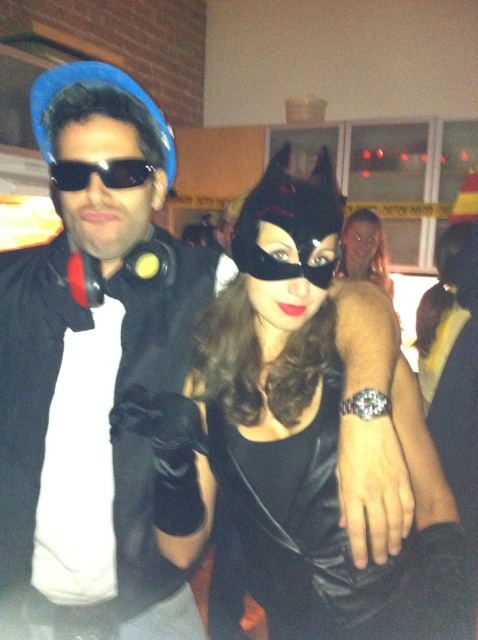
Is black leather mask at center thinner than black matte sunglasses at center?

No, black leather mask at center is not thinner than black matte sunglasses at center.

Who is lower down, black leather mask at center or black matte sunglasses at center?

black leather mask at center is lower down.

The width and height of the screenshot is (478, 640). Describe the element at coordinates (294, 442) in the screenshot. I see `black leather mask at center` at that location.

Image resolution: width=478 pixels, height=640 pixels. What are the coordinates of `black leather mask at center` in the screenshot? It's located at (294, 442).

Is point (312, 310) less distant than point (365, 209)?

Yes.

Does black leather mask at center have a lesser width compared to matte black mask at center?

No, black leather mask at center is not thinner than matte black mask at center.

You are a GUI agent. You are given a task and a screenshot of the screen. Output one action in this format:
    pyautogui.click(x=<x>, y=<y>)
    Task: Click on the black leather mask at center
    
    Given the screenshot: What is the action you would take?
    pyautogui.click(x=294, y=442)

Does matte black jacket at left lie in front of black matte sunglasses at center?

No, matte black jacket at left is further to the viewer.

Does point (93, 493) come behind point (132, 170)?

Yes.

The width and height of the screenshot is (478, 640). In order to click on matte black jacket at left in this screenshot , I will do `click(91, 372)`.